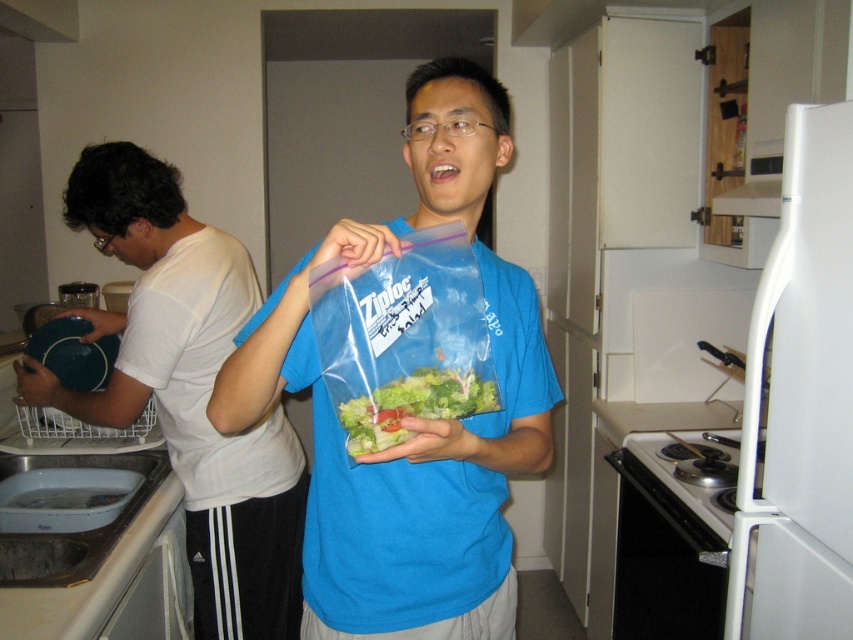
You are organizing the kitchen and need to place both the transparent plastic bag of salad at center and the translucent plastic salad at center on the same shelf. Which one should you place first to ensure they both fit?

The transparent plastic bag of salad at center is taller than the translucent plastic salad at center, so you should place the taller transparent plastic bag of salad at center first to ensure both fit on the shelf.

You are a delivery robot that is 18 inches wide. You need to navigate from the entrance to the kitchen counter. There is a white matte shirt at left and a translucent plastic salad at center in your path. Can you pass through the space between them?

The distance between the white matte shirt at left and the translucent plastic salad at center is 39.18 inches, which is wider than the robot width of 18 inches. Therefore, the robot can safely pass through the space between them.